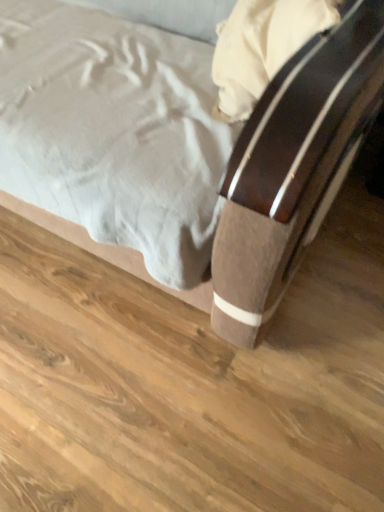
Image resolution: width=384 pixels, height=512 pixels. What do you see at coordinates (190, 384) in the screenshot?
I see `brown wood bed frame at lower center` at bounding box center [190, 384].

Where is `brown wood bed frame at lower center`? Image resolution: width=384 pixels, height=512 pixels. brown wood bed frame at lower center is located at coordinates (190, 384).

Image resolution: width=384 pixels, height=512 pixels. What do you see at coordinates (290, 174) in the screenshot? I see `matte brown bed at center` at bounding box center [290, 174].

What is the approximate width of matte brown bed at center?

35.47 inches.

Identify the location of matte brown bed at center. This screenshot has height=512, width=384. (290, 174).

This screenshot has width=384, height=512. I want to click on brown wood bed frame at lower center, so click(190, 384).

Based on the photo, is matte brown bed at center to the right of brown wood bed frame at lower center from the viewer's perspective?

In fact, matte brown bed at center is to the left of brown wood bed frame at lower center.

Considering their positions, is matte brown bed at center located in front of or behind brown wood bed frame at lower center?

matte brown bed at center is in front of brown wood bed frame at lower center.

Between point (180, 40) and point (179, 385), which one is positioned in front?

The point (179, 385) is in front.

From the image's perspective, which is below, matte brown bed at center or brown wood bed frame at lower center?

brown wood bed frame at lower center, from the image's perspective.

Consider the image. From a real-world perspective, between matte brown bed at center and brown wood bed frame at lower center, who is vertically lower?

In real-world perspective, brown wood bed frame at lower center is lower.

Looking at this image, considering the relative sizes of matte brown bed at center and brown wood bed frame at lower center in the image provided, is matte brown bed at center thinner than brown wood bed frame at lower center?

Indeed, matte brown bed at center has a lesser width compared to brown wood bed frame at lower center.

Does matte brown bed at center have a lesser height compared to brown wood bed frame at lower center?

In fact, matte brown bed at center may be taller than brown wood bed frame at lower center.

Does matte brown bed at center have a larger size compared to brown wood bed frame at lower center?

Indeed, matte brown bed at center has a larger size compared to brown wood bed frame at lower center.

Would you say brown wood bed frame at lower center is part of matte brown bed at center's contents?

No, matte brown bed at center does not contain brown wood bed frame at lower center.

Are matte brown bed at center and brown wood bed frame at lower center far apart?

They are positioned close to each other.

Is matte brown bed at center looking in the opposite direction of brown wood bed frame at lower center?

matte brown bed at center does not have its back to brown wood bed frame at lower center.

Where is `bed that is in front of the brown wood bed frame at lower center`? bed that is in front of the brown wood bed frame at lower center is located at coordinates (290, 174).

Which object is positioned more to the left, brown wood bed frame at lower center or matte brown bed at center?

Positioned to the left is matte brown bed at center.

Between brown wood bed frame at lower center and matte brown bed at center, which one is positioned in front?

matte brown bed at center.

Which is in front, point (294, 386) or point (16, 154)?

The point (16, 154) is more forward.

From the image's perspective, does brown wood bed frame at lower center appear higher than matte brown bed at center?

Incorrect, from the image's perspective, brown wood bed frame at lower center is lower than matte brown bed at center.

From a real-world perspective, is brown wood bed frame at lower center physically above matte brown bed at center?

Incorrect, from a real-world perspective, brown wood bed frame at lower center is lower than matte brown bed at center.

Consider the image. Which of these two, brown wood bed frame at lower center or matte brown bed at center, is wider?

brown wood bed frame at lower center is wider.

Which of these two, brown wood bed frame at lower center or matte brown bed at center, stands shorter?

brown wood bed frame at lower center is shorter.

Can you confirm if brown wood bed frame at lower center is smaller than matte brown bed at center?

Indeed, brown wood bed frame at lower center has a smaller size compared to matte brown bed at center.

Is brown wood bed frame at lower center not inside matte brown bed at center?

brown wood bed frame at lower center is positioned outside matte brown bed at center.

Would you consider brown wood bed frame at lower center to be distant from matte brown bed at center?

Actually, brown wood bed frame at lower center and matte brown bed at center are a little close together.

Looking at this image, is brown wood bed frame at lower center positioned with its back to matte brown bed at center?

No.

How different are the orientations of brown wood bed frame at lower center and matte brown bed at center in degrees?

0.154 degrees separate the facing orientations of brown wood bed frame at lower center and matte brown bed at center.

How distant is brown wood bed frame at lower center from matte brown bed at center?

brown wood bed frame at lower center is 14.07 inches from matte brown bed at center.

The image size is (384, 512). I want to click on plank behind the matte brown bed at center, so click(x=190, y=384).

In the image, there is a brown wood bed frame at lower center. In order to click on bed above it (from the image's perspective) in this screenshot , I will do `click(290, 174)`.

Identify the location of bed to the left of brown wood bed frame at lower center. tap(290, 174).